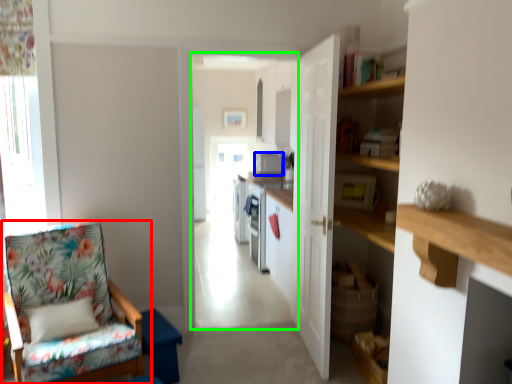
Question: Which object is the closest to the chair (highlighted by a red box)? Choose among these: appliance (highlighted by a blue box) or corridor (highlighted by a green box).

Choices:
 (A) appliance
 (B) corridor

Answer: (A)